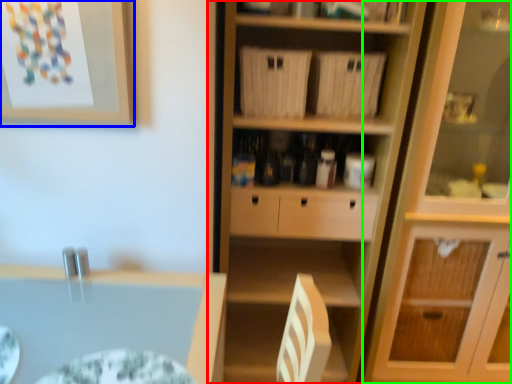
Question: Based on their relative distances, which object is nearer to cupboard (highlighted by a red box)? Choose from picture frame (highlighted by a blue box) and cabinetry (highlighted by a green box).

Choices:
 (A) picture frame
 (B) cabinetry

Answer: (B)